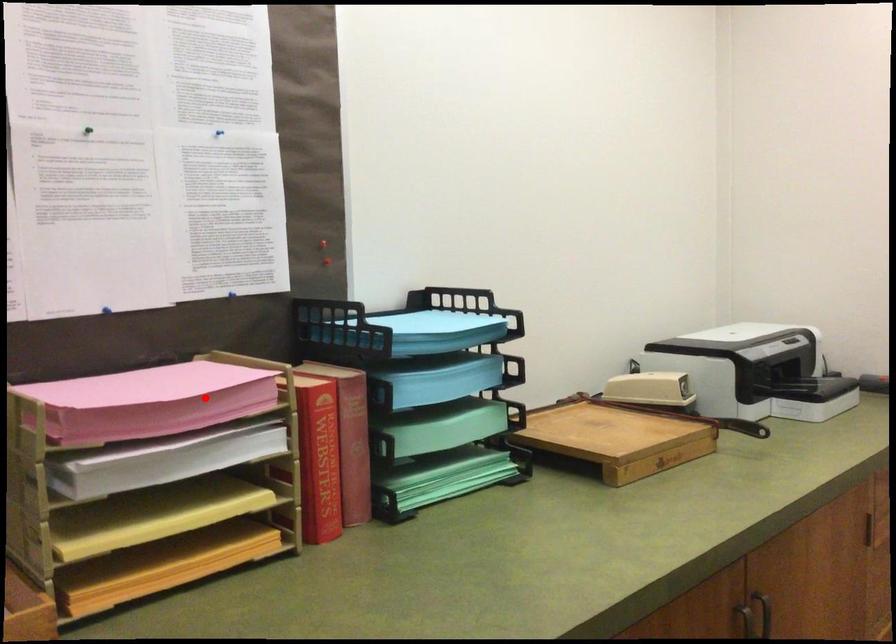
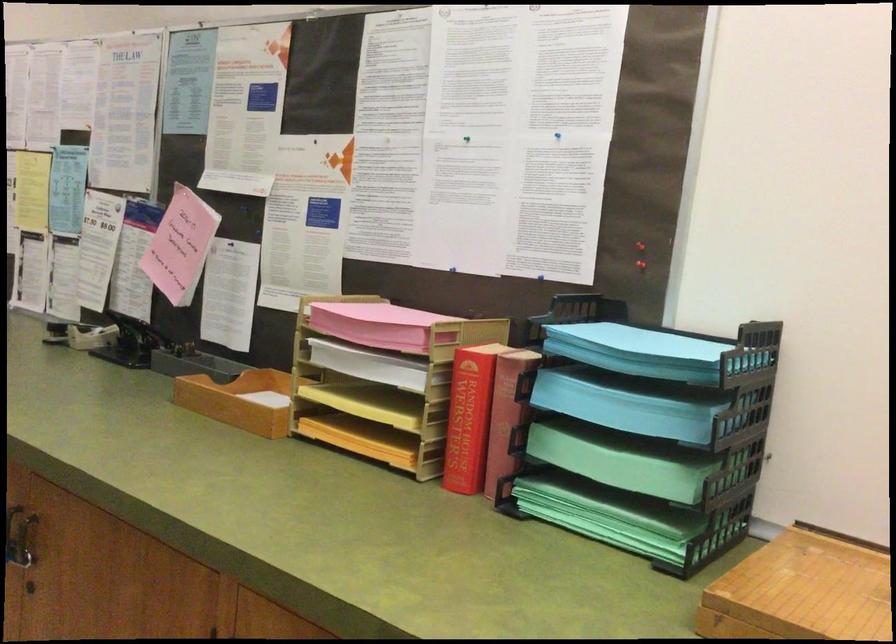
In the second image, find the point that corresponds to the highlighted location in the first image.

(383, 325)